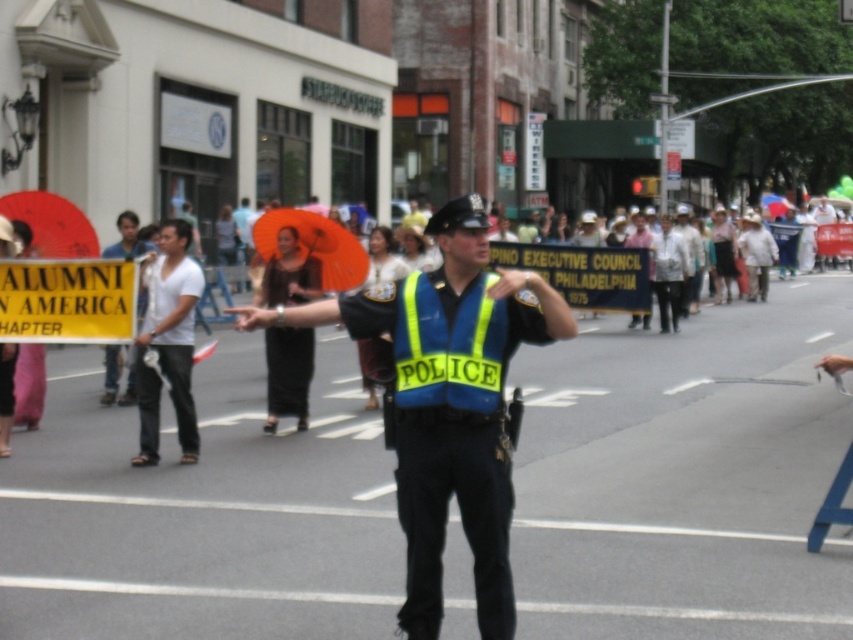
Question: Is yellow reflective fabric police vest at center positioned in front of white cotton shirt at left?

Choices:
 (A) no
 (B) yes

Answer: (B)

Question: Which object is positioned farthest from the blue reflective vest at center?

Choices:
 (A) white cotton shirt at left
 (B) yellow reflective fabric police vest at center

Answer: (A)

Question: Can you confirm if yellow reflective fabric police vest at center is positioned below white cotton shirt at left?

Choices:
 (A) yes
 (B) no

Answer: (B)

Question: Considering the relative positions of blue reflective vest at center and yellow reflective fabric police vest at center in the image provided, where is blue reflective vest at center located with respect to yellow reflective fabric police vest at center?

Choices:
 (A) above
 (B) below

Answer: (B)

Question: Which object appears farthest from the camera in this image?

Choices:
 (A) yellow reflective fabric police vest at center
 (B) blue reflective vest at center

Answer: (A)

Question: Estimate the real-world distances between objects in this image. Which object is farther from the yellow reflective fabric police vest at center?

Choices:
 (A) white cotton shirt at left
 (B) blue reflective vest at center

Answer: (A)